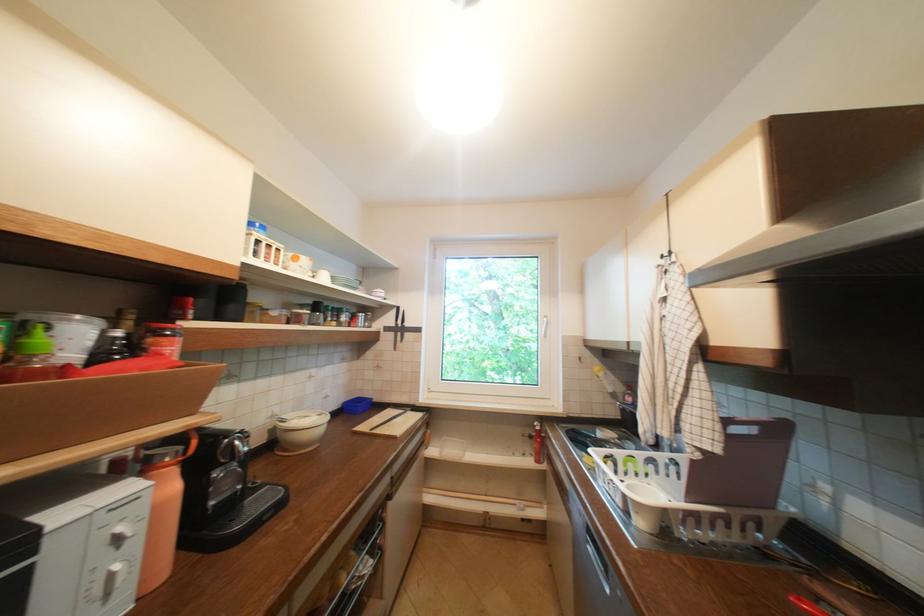
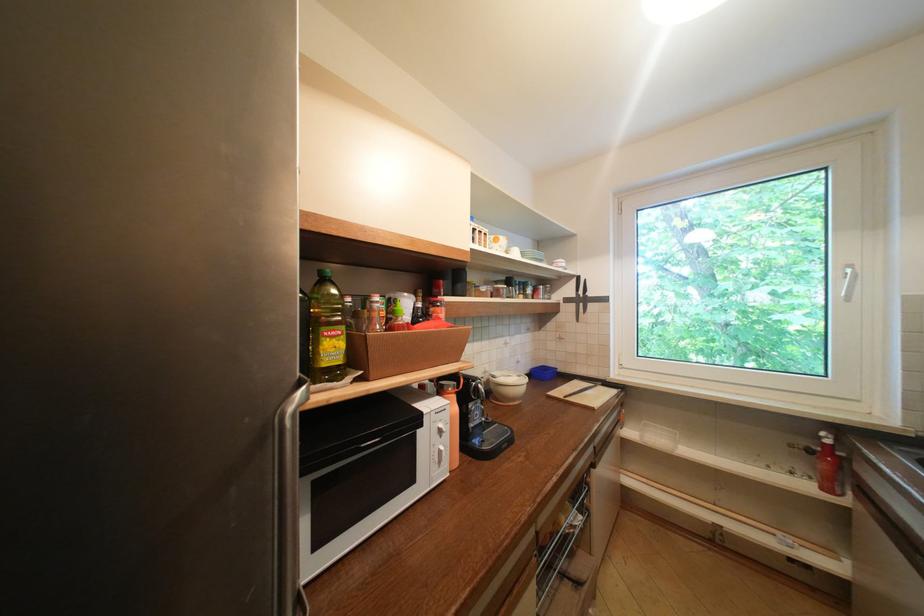
The point at (361, 588) is marked in the first image. Where is the corresponding point in the second image?

(576, 532)